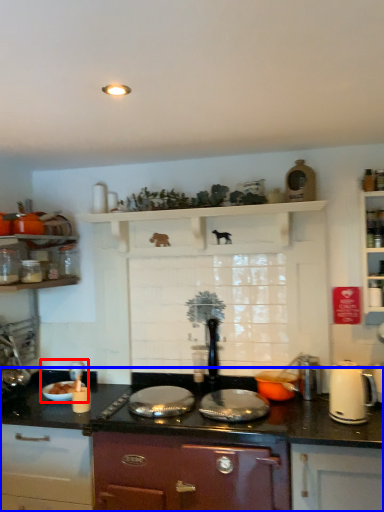
Question: Which point is further to the camera, sink (highlighted by a red box) or countertop (highlighted by a blue box)?

Choices:
 (A) sink
 (B) countertop

Answer: (A)